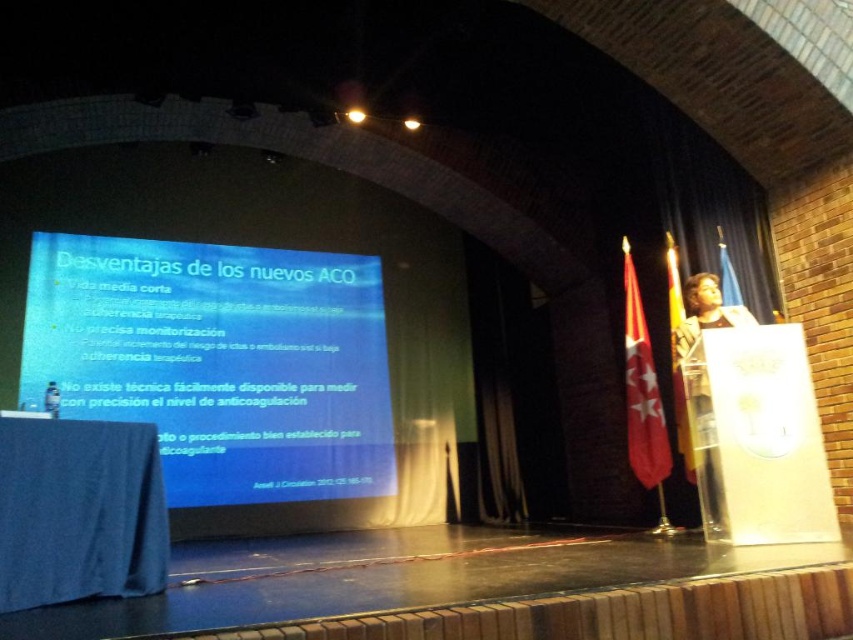
You are an attendee at the presentation and want to take a photo of the blue glossy projector screen at center and the dark brown leather jacket at right. Which object should you focus on first if you want to capture both in one shot without moving the camera?

The blue glossy projector screen at center is to the left of the dark brown leather jacket at right, so you should focus on the blue glossy projector screen at center first to ensure both are in frame.

You are an event organizer who needs to set up a new banner that must be placed between the blue glossy projector screen at center and the dark brown leather jacket at right. The banner is 1.2 meters wide. Can the banner fit between them?

The blue glossy projector screen at center is larger in size than the dark brown leather jacket at right, so the distance between them may accommodate the 1.2 meter wide banner. However, without specific measurements of the space between them, it is uncertain. The organizer should verify the exact distance before placing the banner.

You are a speaker at a conference and need to decide where to place your notes. The blue glossy projector screen at center and the dark brown leather jacket at right are in your view. Which object is wider, and should you place your notes closer to the wider object to ensure they are visible from the audience?

The blue glossy projector screen at center is wider than the dark brown leather jacket at right. To ensure visibility from the audience, place your notes closer to the wider object, the blue glossy projector screen at center, as it occupies more space in the front.